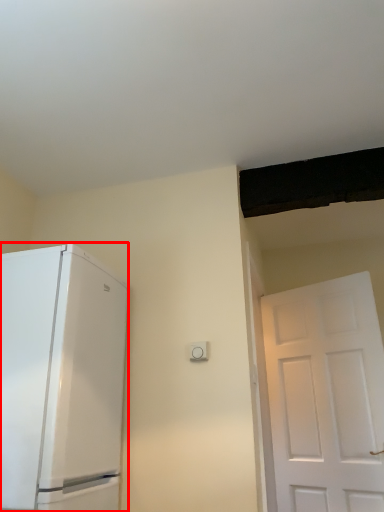
Question: From the image's perspective, what is the correct spatial positioning of refrigerator (annotated by the red box) in reference to light switch?

Choices:
 (A) above
 (B) below

Answer: (B)